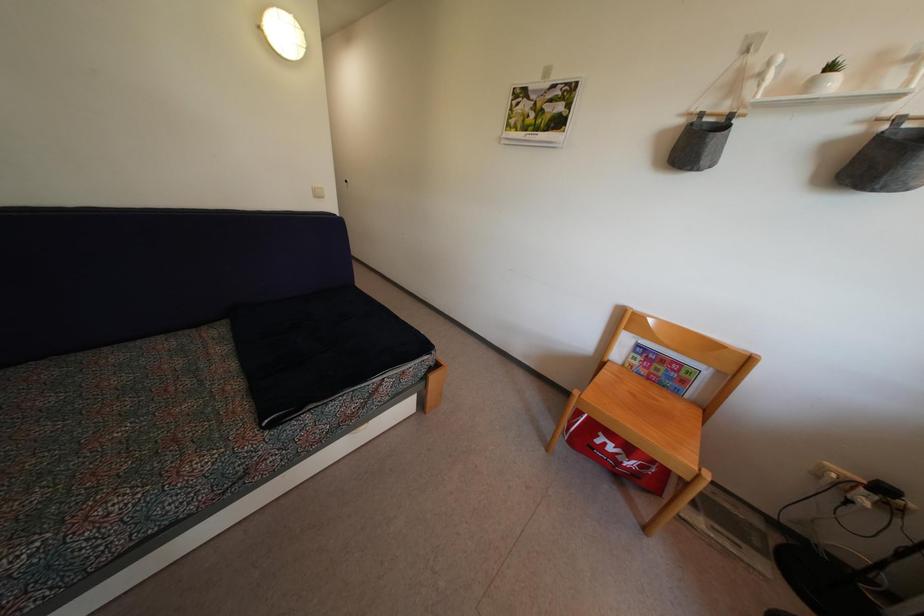
This screenshot has width=924, height=616. What are the coordinates of `sofa sitting surface` in the screenshot? It's located at (101, 436).